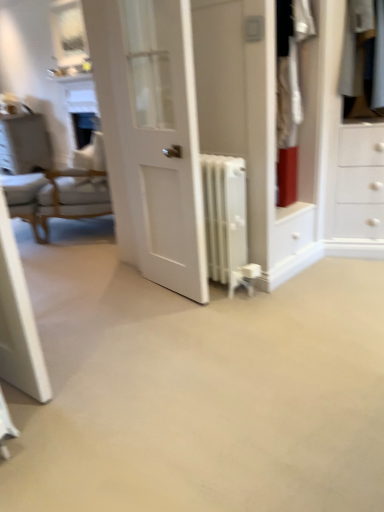
Locate an element on the screen. vacant space to the left of white glossy door at center is located at coordinates (120, 305).